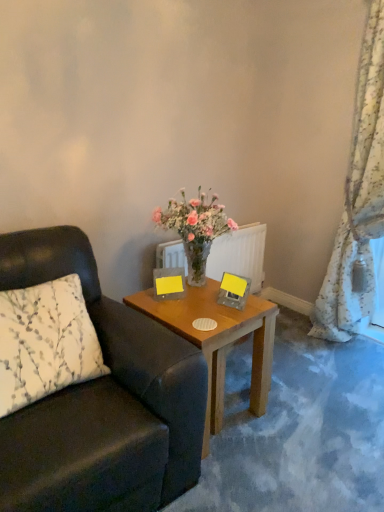
Image resolution: width=384 pixels, height=512 pixels. What are the coordinates of `vacant region to the left of yellow paper at center, the 1th picture frame when ordered from right to left` in the screenshot? It's located at (196, 310).